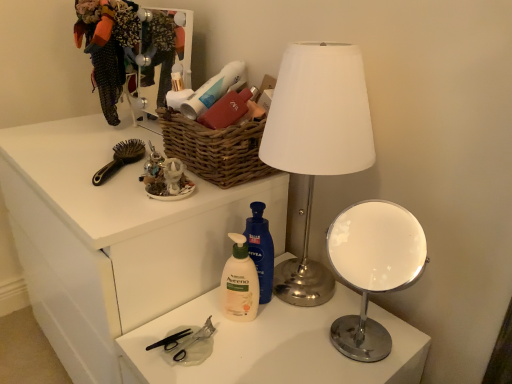
What is the approximate height of chrome/metallic table lamp at right?

chrome/metallic table lamp at right is 26.98 centimeters tall.

This screenshot has width=512, height=384. I want to click on white plastic table at center, so click(x=273, y=346).

I want to click on woven brown basket at upper center, so point(215,149).

What do you see at coordinates (113, 237) in the screenshot? This screenshot has width=512, height=384. I see `white matte desk at center` at bounding box center [113, 237].

Describe the element at coordinates (120, 159) in the screenshot. I see `black plastic brush at upper left` at that location.

Measure the distance between point (97, 184) and camera.

Point (97, 184) is 37.36 inches from camera.

The height and width of the screenshot is (384, 512). Find the location of `black plastic scissors at lower center`. black plastic scissors at lower center is located at coordinates (194, 346).

You are a GUI agent. You are given a task and a screenshot of the screen. Output one action in this format:
    pyautogui.click(x=<x>, y=<y>)
    Task: Click on the white plastic pump bottle at center, the 2th cleaning product viewed from the left
    This screenshot has height=384, width=512.
    Given the screenshot: What is the action you would take?
    pyautogui.click(x=261, y=249)

Identify the location of chrome/metallic table lamp at right. (373, 269).

Which is correct: metallic silver mirror at upper center is inside black plastic brush at upper left, or outside of it?

metallic silver mirror at upper center is spatially situated outside black plastic brush at upper left.

Are metallic silver mirror at upper center and black plastic brush at upper left located far from each other?

metallic silver mirror at upper center is actually quite close to black plastic brush at upper left.

Based on the photo, considering the relative sizes of metallic silver mirror at upper center and black plastic brush at upper left in the image provided, is metallic silver mirror at upper center taller than black plastic brush at upper left?

Indeed, metallic silver mirror at upper center has a greater height compared to black plastic brush at upper left.

What's the angular difference between metallic silver mirror at upper center and black plastic brush at upper left's facing directions?

The facing directions of metallic silver mirror at upper center and black plastic brush at upper left are 40.3 degrees apart.

Which point is more forward, (x=380, y=236) or (x=177, y=126)?

The point (x=177, y=126) is in front.

Can you confirm if chrome/metallic table lamp at right is taller than woven brown basket at upper center?

Yes.

Are chrome/metallic table lamp at right and woven brown basket at upper center far apart?

Actually, chrome/metallic table lamp at right and woven brown basket at upper center are a little close together.

Can you tell me how much chrome/metallic table lamp at right and woven brown basket at upper center differ in facing direction?

The facing directions of chrome/metallic table lamp at right and woven brown basket at upper center are 2.49 degrees apart.

Based on the photo, is there a large distance between white plastic pump bottle at center, the first cleaning product viewed from the right, and black plastic brush at upper left?

No, there isn't a large distance between white plastic pump bottle at center, the first cleaning product viewed from the right, and black plastic brush at upper left.

Which object is further away from the camera, white plastic pump bottle at center, the 2th cleaning product viewed from the left, or black plastic brush at upper left?

black plastic brush at upper left is further from the camera.

Is black plastic brush at upper left at the back of white plastic pump bottle at center, the first cleaning product viewed from the right?

No, white plastic pump bottle at center, the first cleaning product viewed from the right, is not facing the opposite direction of black plastic brush at upper left.

From a real-world perspective, is woven brown basket at upper center under metallic silver mirror at upper center?

Correct, in the physical world, woven brown basket at upper center is lower than metallic silver mirror at upper center.

Which is farther from the camera, (262, 165) or (150, 34)?

The point (150, 34) is behind.

From the image's perspective, is woven brown basket at upper center located above metallic silver mirror at upper center?

No, from the image's perspective, woven brown basket at upper center is not above metallic silver mirror at upper center.

Which of these two, woven brown basket at upper center or metallic silver mirror at upper center, is bigger?

With larger size is woven brown basket at upper center.

How far apart are metallic silver mirror at upper center and black plastic scissors at lower center?

They are 31.29 inches apart.

Are metallic silver mirror at upper center and black plastic scissors at lower center located far from each other?

No.

Could you tell me if metallic silver mirror at upper center is facing black plastic scissors at lower center?

No, metallic silver mirror at upper center is not oriented towards black plastic scissors at lower center.

From the image's perspective, relative to black plastic scissors at lower center, is metallic silver mirror at upper center above or below?

metallic silver mirror at upper center is above black plastic scissors at lower center.

Identify the location of basket in front of the metallic silver mirror at upper center. (215, 149).

Based on the photo, which object is positioned more to the left, metallic silver mirror at upper center or woven brown basket at upper center?

From the viewer's perspective, metallic silver mirror at upper center appears more on the left side.

Could you tell me if metallic silver mirror at upper center is turned towards woven brown basket at upper center?

No, metallic silver mirror at upper center is not oriented towards woven brown basket at upper center.

Looking at this image, is metallic silver mirror at upper center far from woven brown basket at upper center?

metallic silver mirror at upper center is actually quite close to woven brown basket at upper center.

Considering the sizes of black plastic brush at upper left and white matte lotion at center, which appears as the 2th cleaning product when viewed from the right, in the image, is black plastic brush at upper left wider or thinner than white matte lotion at center, which appears as the 2th cleaning product when viewed from the right,?

Clearly, black plastic brush at upper left has more width compared to white matte lotion at center, which appears as the 2th cleaning product when viewed from the right.

From a real-world perspective, which is physically below, black plastic brush at upper left or white matte lotion at center, which appears as the 2th cleaning product when viewed from the right?

In real-world perspective, white matte lotion at center, which appears as the 2th cleaning product when viewed from the right, is lower.

Is black plastic brush at upper left taller or shorter than white matte lotion at center, which appears as the 2th cleaning product when viewed from the right?

black plastic brush at upper left is shorter than white matte lotion at center, which appears as the 2th cleaning product when viewed from the right.

Is black plastic brush at upper left looking in the opposite direction of white matte lotion at center, which appears as the 2th cleaning product when viewed from the right?

That's not correct — black plastic brush at upper left is not looking away from white matte lotion at center, which appears as the 2th cleaning product when viewed from the right.

Identify the location of brush directly beneath the metallic silver mirror at upper center (from a real-world perspective). (120, 159).

Identify the location of table lamp located below the woven brown basket at upper center (from the image's perspective). The image size is (512, 384). (373, 269).

When comparing their distances from chrome/metallic table lamp at right, does white matte lotion at center, which appears as the 2th cleaning product when viewed from the right, or white matte desk at center seem further?

white matte desk at center lies further to chrome/metallic table lamp at right than the other object.

When comparing their distances from black plastic brush at upper left, does white matte desk at center or woven brown basket at upper center seem closer?

woven brown basket at upper center is closer to black plastic brush at upper left.

Considering their positions, is patterned fabric dress at upper left positioned further to white matte desk at center than metallic silver mirror at upper center?

metallic silver mirror at upper center.

Which object lies nearer to the anchor point chrome/metallic table lamp at right, black plastic scissors at lower center or metallic silver lamp at center?

metallic silver lamp at center.

Looking at the image, which one is located further to black plastic scissors at lower center, white matte lotion at center, which appears as the 2th cleaning product when viewed from the right, or patterned fabric dress at upper left?

patterned fabric dress at upper left is further to black plastic scissors at lower center.

Considering their positions, is metallic silver mirror at upper center positioned closer to black plastic brush at upper left than white plastic table at center?

metallic silver mirror at upper center lies closer to black plastic brush at upper left than the other object.

From the image, which object appears to be nearer to white matte lotion at center, which appears as the 2th cleaning product when viewed from the right, white matte desk at center or woven brown basket at upper center?

woven brown basket at upper center is positioned closer to the anchor white matte lotion at center, which appears as the 2th cleaning product when viewed from the right.

Estimate the real-world distances between objects in this image. Which object is closer to metallic silver mirror at upper center, metallic silver lamp at center or white matte lotion at center, which is counted as the first cleaning product, starting from the left?

The object closer to metallic silver mirror at upper center is metallic silver lamp at center.

The width and height of the screenshot is (512, 384). I want to click on brush that lies between woven brown basket at upper center and black plastic scissors at lower center from top to bottom, so click(x=120, y=159).

At what (x,y) coordinates should I click in order to perform the action: click on table lamp that lies between woven brown basket at upper center and black plastic scissors at lower center from top to bottom. Please return your answer as a coordinate pair (x, y). Looking at the image, I should click on (373, 269).

The height and width of the screenshot is (384, 512). In order to click on mirror between patterned fabric dress at upper left and black plastic brush at upper left vertically in this screenshot , I will do `click(168, 60)`.

Find the location of `scissors between white matte lotion at center, which is counted as the first cleaning product, starting from the left, and white plastic table at center from top to bottom`. scissors between white matte lotion at center, which is counted as the first cleaning product, starting from the left, and white plastic table at center from top to bottom is located at coordinates (194, 346).